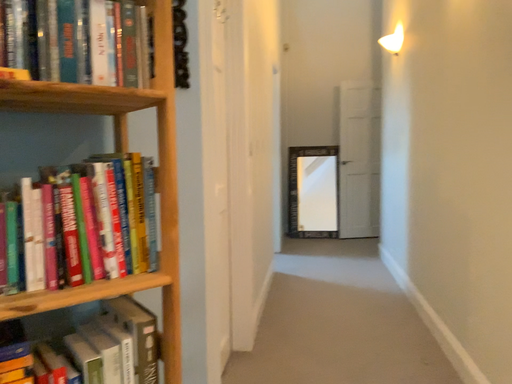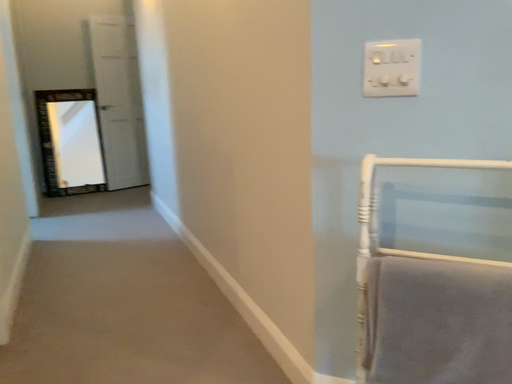
Question: Which way did the camera rotate in the video?

Choices:
 (A) rotated right
 (B) rotated left

Answer: (A)